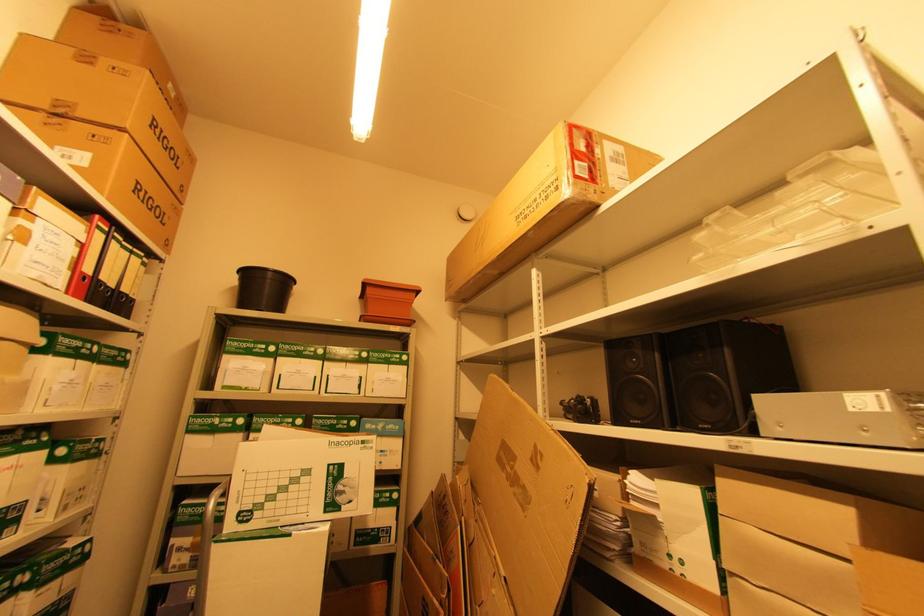
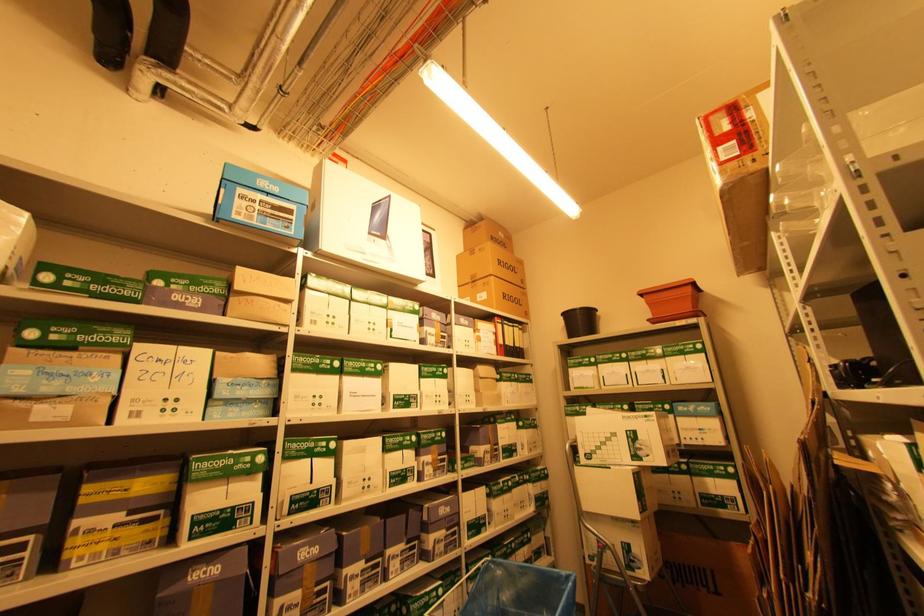
Question: The images are taken continuously from a first-person perspective. In which direction is your viewpoint rotating?

Choices:
 (A) Left
 (B) Right
 (C) Up
 (D) Down

Answer: (A)